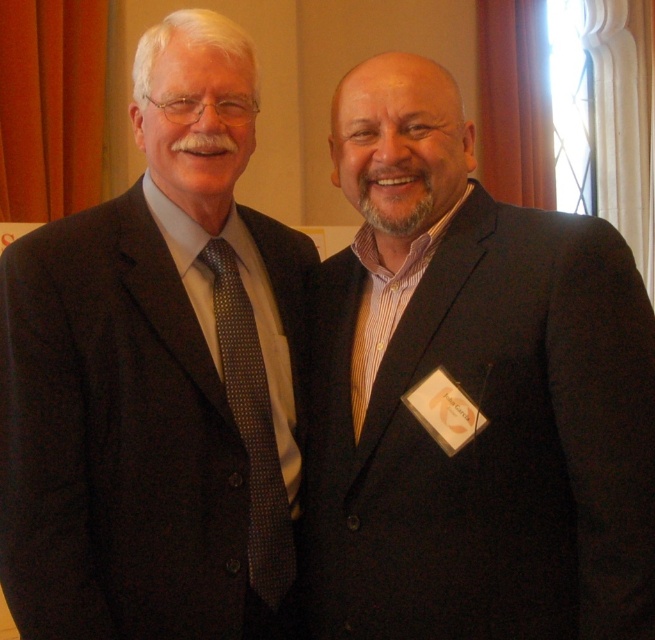
Question: Is matte black suit at center to the right of matte black suit at left from the viewer's perspective?

Choices:
 (A) yes
 (B) no

Answer: (A)

Question: Which point is closer to the camera?

Choices:
 (A) (626, 282)
 (B) (229, 344)

Answer: (A)

Question: Is matte black suit at left above dark gray dotted tie at left?

Choices:
 (A) no
 (B) yes

Answer: (B)

Question: Which of these objects is positioned closest to the dark gray dotted tie at left?

Choices:
 (A) matte black suit at left
 (B) matte black suit at center

Answer: (A)

Question: Does matte black suit at left appear over dark gray dotted tie at left?

Choices:
 (A) no
 (B) yes

Answer: (B)

Question: Which object appears farthest from the camera in this image?

Choices:
 (A) dark gray dotted tie at left
 (B) matte black suit at center

Answer: (A)